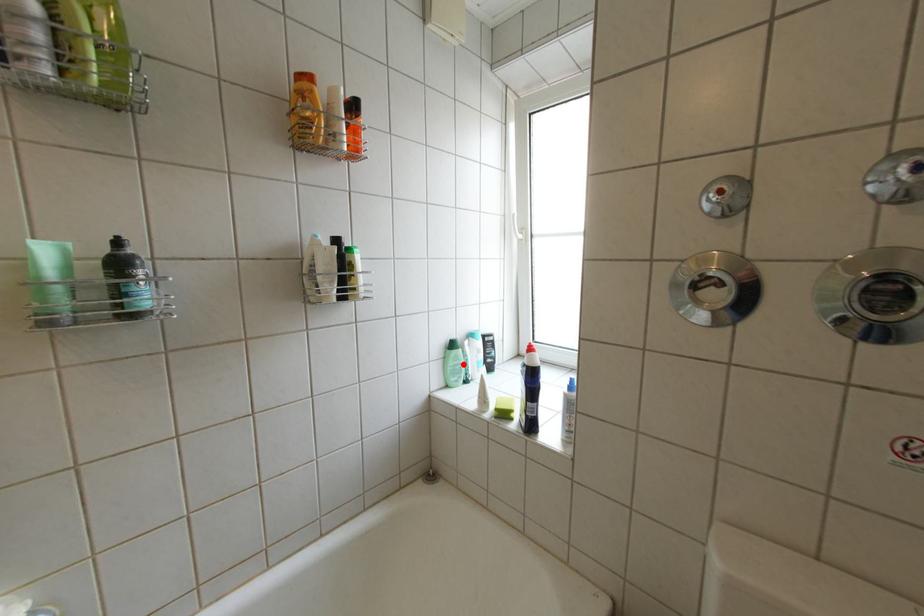
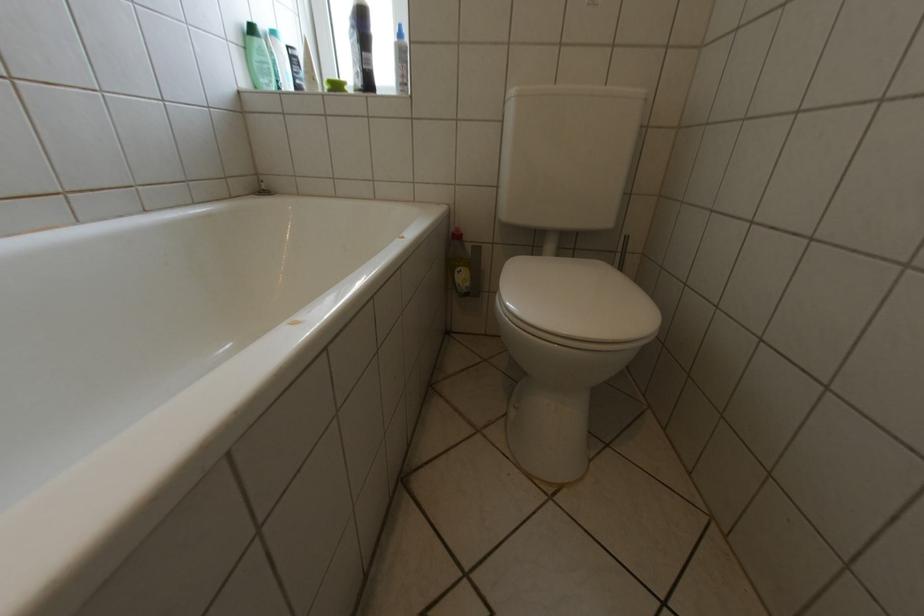
Where in the second image is the point corresponding to the highlighted location from the first image?

(268, 59)